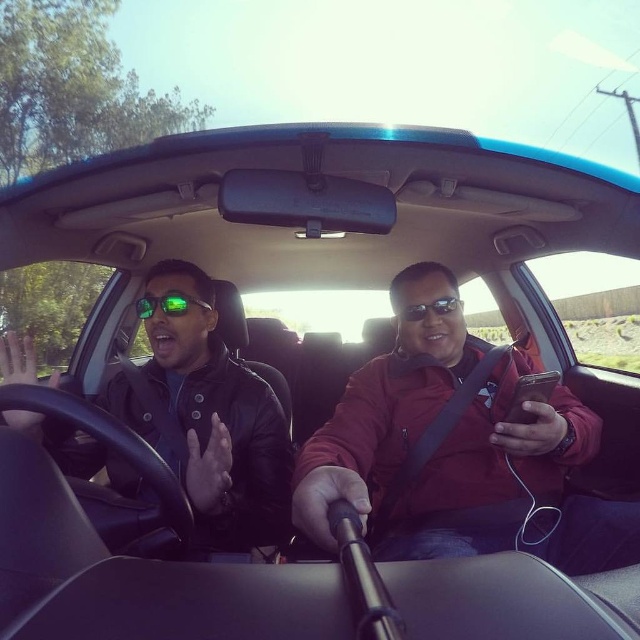
Question: Is matte red jacket at center smaller than leather jacket at left?

Choices:
 (A) yes
 (B) no

Answer: (B)

Question: Estimate the real-world distances between objects in this image. Which object is farther from the matte red jacket at center?

Choices:
 (A) green reflective lenses at center
 (B) leather jacket at left

Answer: (A)

Question: Is matte red jacket at center bigger than matte black sunglasses at center?

Choices:
 (A) no
 (B) yes

Answer: (B)

Question: Is matte red jacket at center below green reflective lenses at center?

Choices:
 (A) no
 (B) yes

Answer: (B)

Question: Which point is farther from the camera taking this photo?

Choices:
 (A) (36, 417)
 (B) (445, 310)

Answer: (B)

Question: Which point is closer to the camera?

Choices:
 (A) (154, 298)
 (B) (381, 365)

Answer: (A)